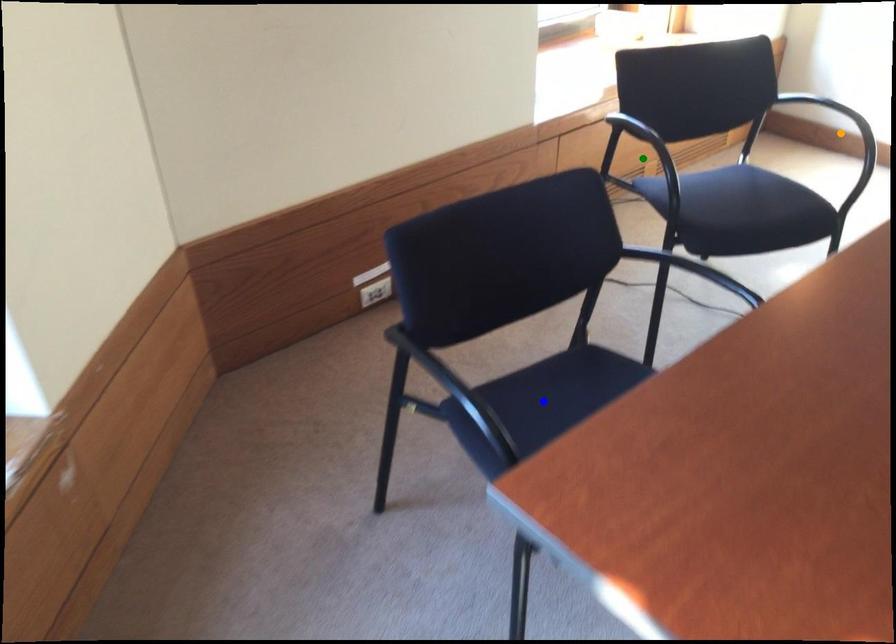
Based on the photo, order these from farthest to nearest:
green point
blue point
orange point

Result: orange point < green point < blue point